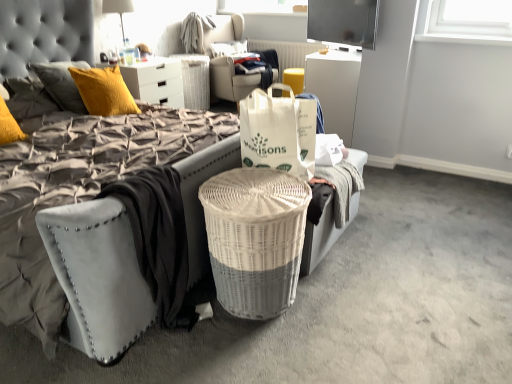
Question: Does suede-like gray mattress at lower left come behind velvet grey bed at center?

Choices:
 (A) yes
 (B) no

Answer: (A)

Question: Is suede-like gray mattress at lower left directly adjacent to velvet grey bed at center?

Choices:
 (A) yes
 (B) no

Answer: (A)

Question: Considering the relative sizes of suede-like gray mattress at lower left and velvet grey bed at center in the image provided, is suede-like gray mattress at lower left wider than velvet grey bed at center?

Choices:
 (A) no
 (B) yes

Answer: (A)

Question: Does suede-like gray mattress at lower left turn towards velvet grey bed at center?

Choices:
 (A) yes
 (B) no

Answer: (A)

Question: Is suede-like gray mattress at lower left at the right side of velvet grey bed at center?

Choices:
 (A) no
 (B) yes

Answer: (B)

Question: Does suede-like gray mattress at lower left have a lesser height compared to velvet grey bed at center?

Choices:
 (A) no
 (B) yes

Answer: (B)

Question: Is velvet grey bed at center beside white textured bean bag chair at center?

Choices:
 (A) yes
 (B) no

Answer: (B)

Question: Is velvet grey bed at center taller than white textured bean bag chair at center?

Choices:
 (A) yes
 (B) no

Answer: (A)

Question: Is velvet grey bed at center surrounding white textured bean bag chair at center?

Choices:
 (A) no
 (B) yes

Answer: (A)

Question: Is velvet grey bed at center facing towards white textured bean bag chair at center?

Choices:
 (A) no
 (B) yes

Answer: (A)

Question: From the image's perspective, is velvet grey bed at center located above white textured bean bag chair at center?

Choices:
 (A) yes
 (B) no

Answer: (B)

Question: Is velvet grey bed at center not near white textured bean bag chair at center?

Choices:
 (A) no
 (B) yes

Answer: (B)

Question: Can you confirm if flat screen tv at upper center is shorter than suede-like gray mattress at lower left?

Choices:
 (A) no
 (B) yes

Answer: (B)